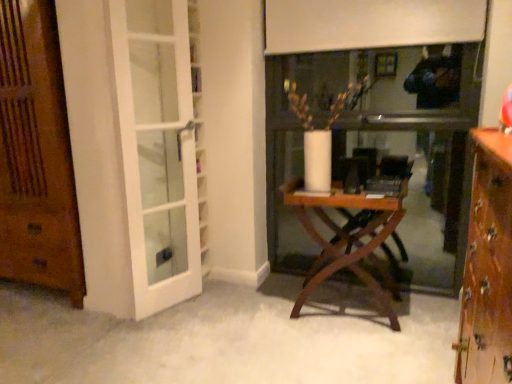
Question: Choose the correct answer: Is wooden door at left inside white glass door at left or outside it?

Choices:
 (A) outside
 (B) inside

Answer: (A)

Question: Based on their sizes in the image, would you say wooden door at left is bigger or smaller than white glass door at left?

Choices:
 (A) big
 (B) small

Answer: (A)

Question: Estimate the real-world distances between objects in this image. Which object is farther from the wooden door at left?

Choices:
 (A) wooden cabinet at right
 (B) wooden folding table at center
 (C) white glass door at left

Answer: (A)

Question: Which is farther from the white glass door at left?

Choices:
 (A) wooden folding table at center
 (B) wooden door at left
 (C) wooden cabinet at right

Answer: (C)